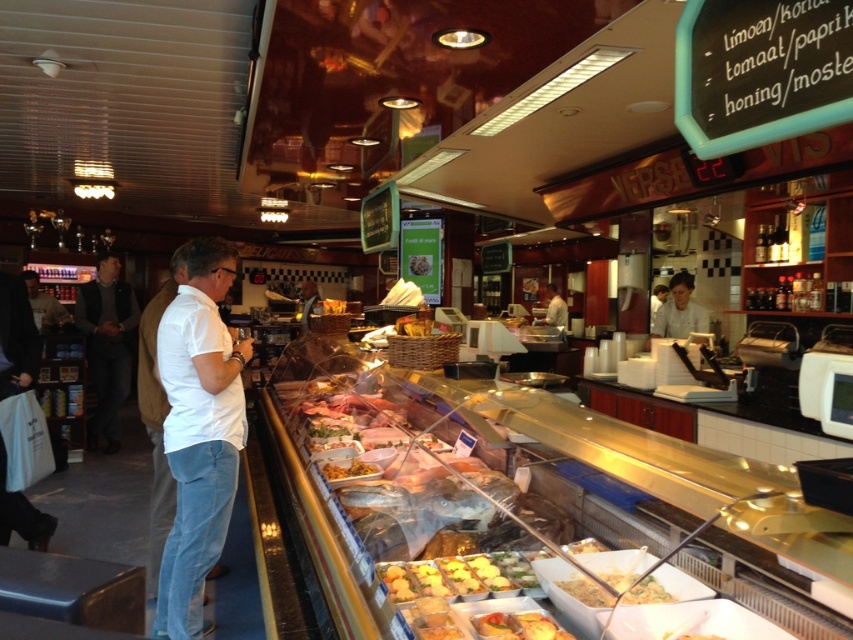
You are a customer in the deli and want to reach the yellow creamy soup at center from the white shirt at center. Can you walk directly to it without needing to go around any obstacles?

The distance between the yellow creamy soup at center and the white shirt at center is 10.22 meters, so you can walk directly to it as there are no obstacles mentioned in the scene description. However, the large distance suggests it might be located in a different area, so you might need to navigate through the space accordingly.

You are a customer in the deli and want to order the golden crispy fries at center. The staff member is standing near the dark gray sweater at left. Can you tell me which direction you should walk to reach the staff member?

The dark gray sweater at left is on the left side of the golden crispy fries at center, so you should walk to the left to reach the staff member near the dark gray sweater at left.